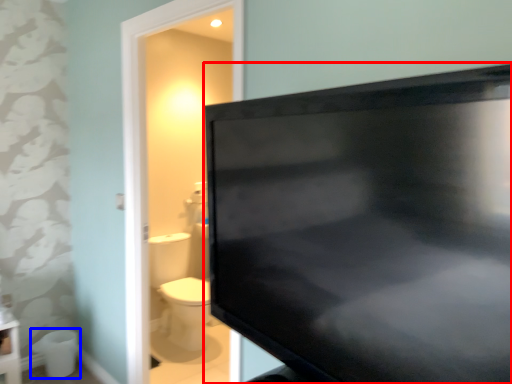
Question: Which object is further to the camera taking this photo, television (highlighted by a red box) or toilet bowl (highlighted by a blue box)?

Choices:
 (A) television
 (B) toilet bowl

Answer: (B)